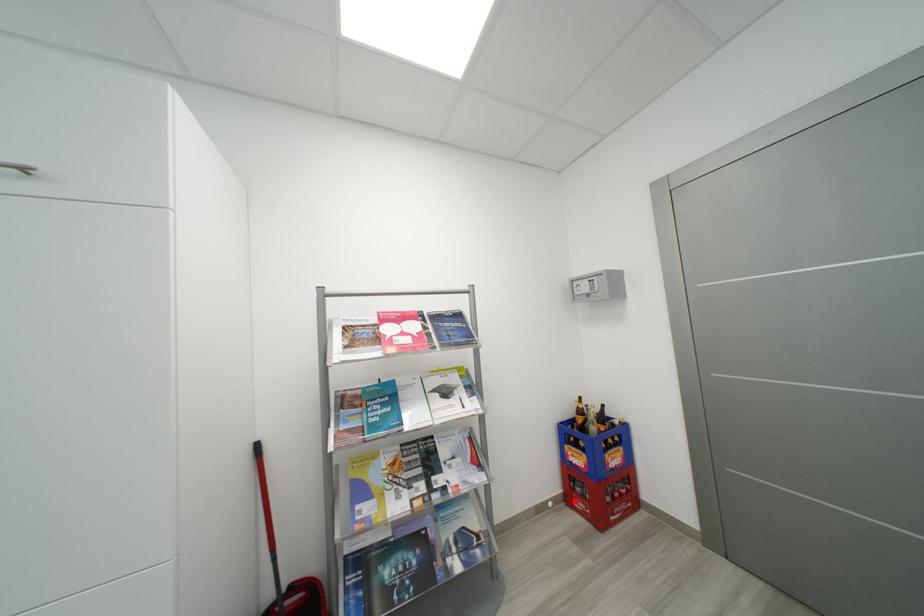
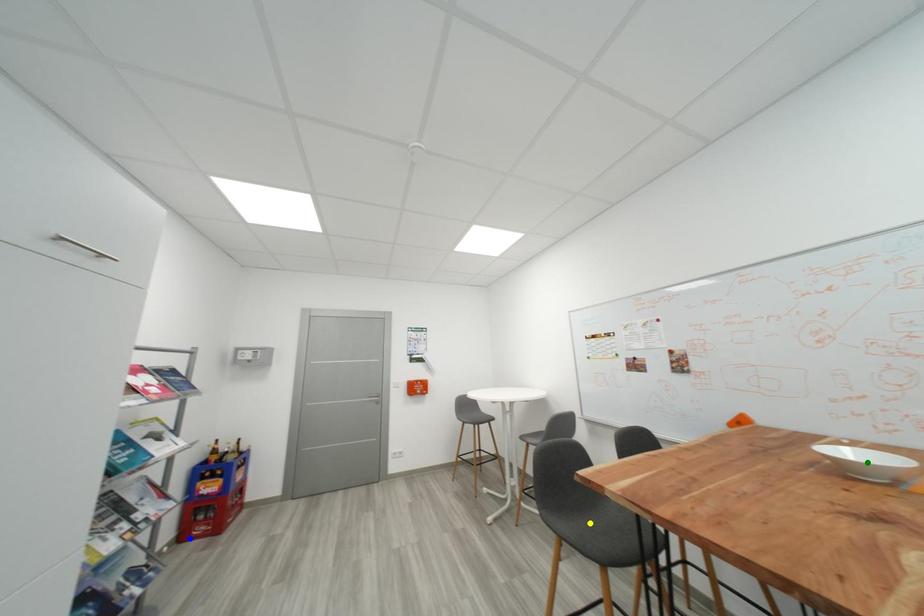
Question: I am providing you with two images of the same scene from different viewpoints. A red point is marked on the first image. You are given multiple points on the second image. Which spot in image 2 lines up with the point in image 1?

Choices:
 (A) blue point
 (B) yellow point
 (C) green point

Answer: (A)